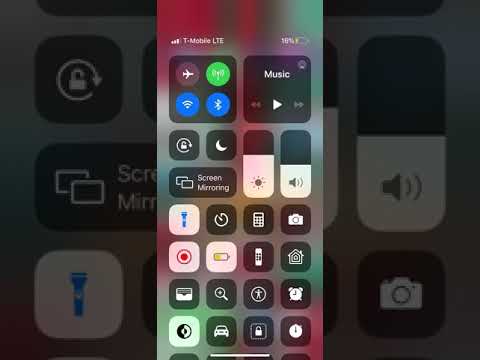
Where is `clock`? clock is located at coordinates point(292,290).